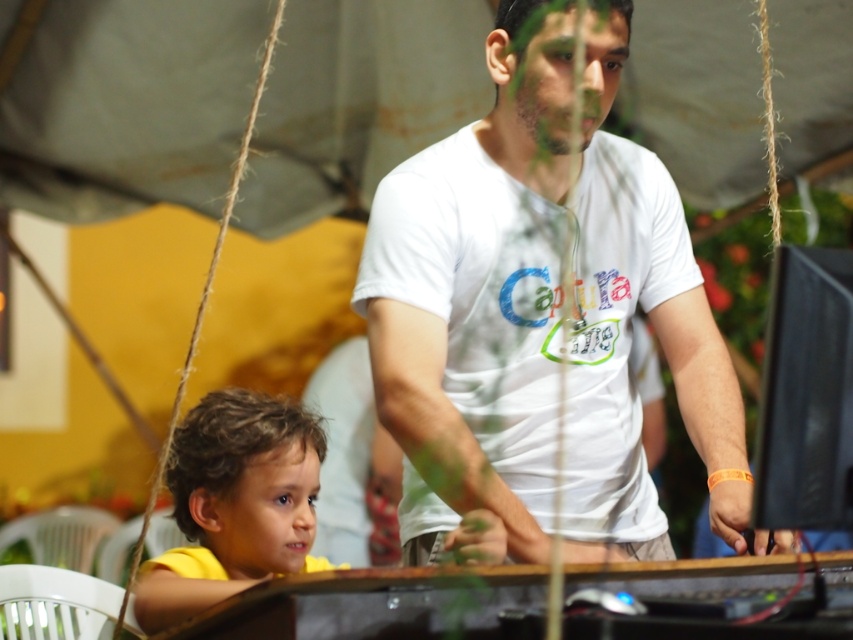
Question: Is yellow matte shirt at lower left thinner than matte white face at center?

Choices:
 (A) yes
 (B) no

Answer: (B)

Question: Is white cotton t-shirt at center positioned behind smooth brown hair at lower left?

Choices:
 (A) yes
 (B) no

Answer: (B)

Question: Which is farther from the yellow matte shirt at lower left?

Choices:
 (A) smooth brown hair at lower left
 (B) matte white face at center

Answer: (B)

Question: Which object is the closest to the smooth brown hair at lower left?

Choices:
 (A) white cotton t-shirt at center
 (B) matte white face at center
 (C) yellow matte shirt at lower left

Answer: (C)

Question: Does white cotton t-shirt at center have a smaller size compared to smooth brown hair at lower left?

Choices:
 (A) yes
 (B) no

Answer: (B)

Question: Which point is closer to the camera?

Choices:
 (A) white cotton t-shirt at center
 (B) smooth brown hair at lower left

Answer: (A)